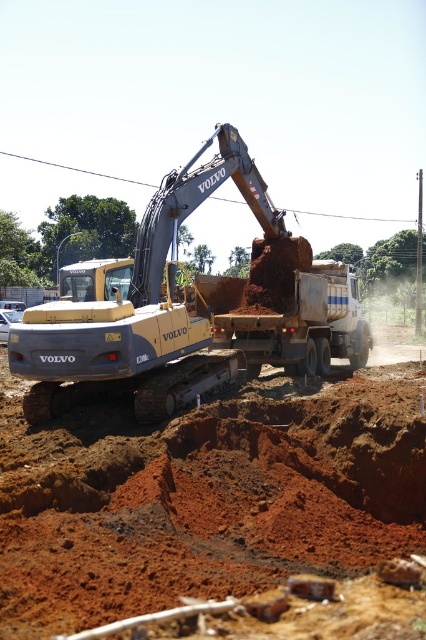
Question: Observing the image, what is the correct spatial positioning of yellow metallic excavator at center in reference to brown clay trailer truck at center?

Choices:
 (A) right
 (B) left

Answer: (B)

Question: Is yellow metallic excavator at center above brown clay trailer truck at center?

Choices:
 (A) no
 (B) yes

Answer: (B)

Question: Can you confirm if yellow metallic excavator at center is positioned to the right of brown clay trailer truck at center?

Choices:
 (A) no
 (B) yes

Answer: (A)

Question: Which of the following is the farthest from the observer?

Choices:
 (A) brown clay trailer truck at center
 (B) yellow metallic excavator at center

Answer: (A)